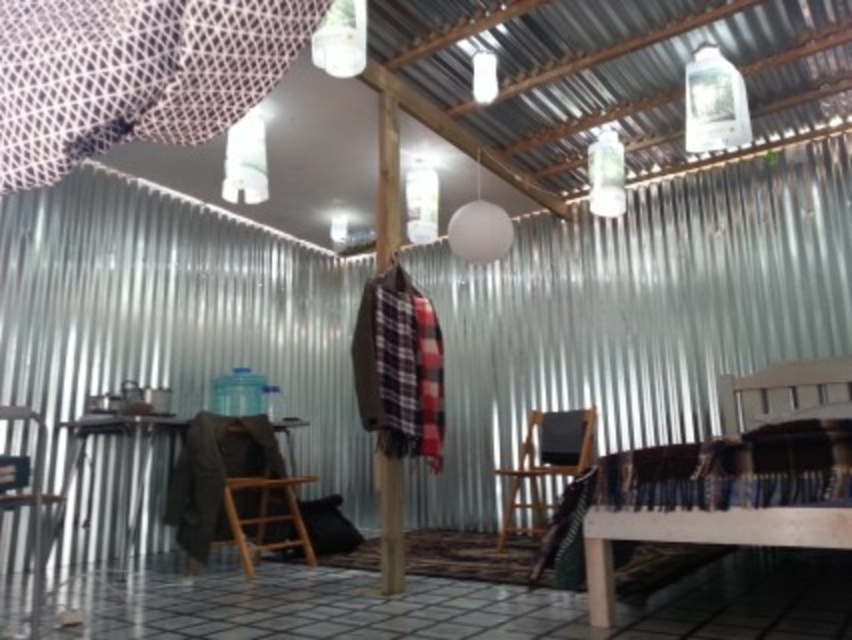
You are sitting in the brown wooden chair at lower left and want to reach the clear plastic bottle at upper right. Can you easily grab it without moving your chair?

The clear plastic bottle at upper right is behind the brown wooden chair at lower left, so you cannot easily grab it without moving your chair.

You are standing in the center of the room and want to move to the brown wooden chair at lower left. Based on its coordinates, can you estimate the direction you should walk to reach it?

The brown wooden chair at lower left is located at point (x=232, y=486), which suggests it is positioned to the lower left of the room. To reach it from the center, you should walk towards the lower left direction.

You are designing a layout for a new room and want to place a new sofa that is 1.2 meters wide. You have two options for placement areas. The first area is near the white mesh curtain at upper left, and the second area is near the brown wooden chair at lower left. Based on the size of the objects in the scene, which area would you choose for the sofa to ensure it fits properly?

The white mesh curtain at upper left has a smaller size compared to the brown wooden chair at lower left. Since the sofa is 1.2 meters wide, it would fit better near the brown wooden chair at lower left, which has more space due to its larger size.